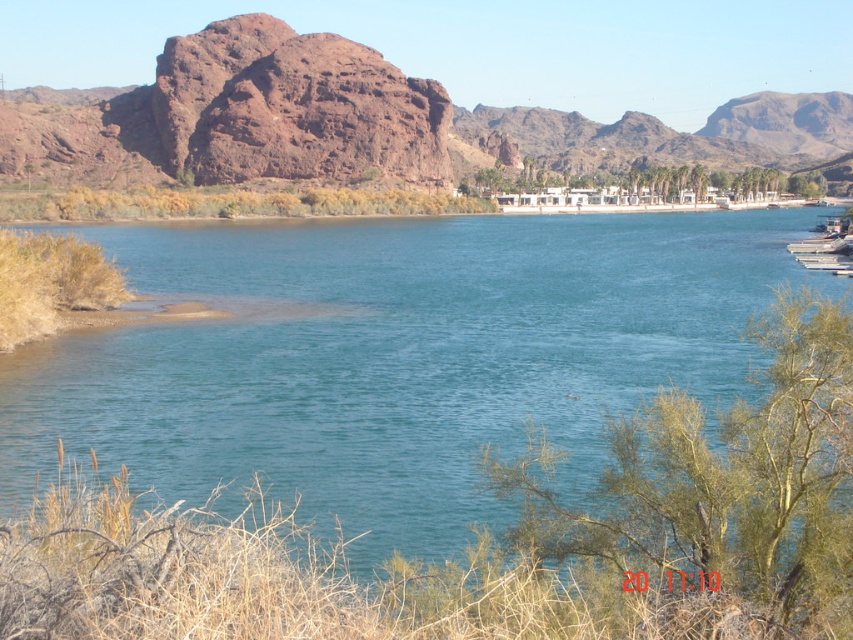
Where is `blue water at center`? This screenshot has width=853, height=640. blue water at center is located at coordinates (399, 358).

From the picture: Between blue water at center and rustic rock formation at upper center, which one appears on the left side from the viewer's perspective?

blue water at center is more to the left.

At what (x,y) coordinates should I click in order to perform the action: click on blue water at center. Please return your answer as a coordinate pair (x, y). The width and height of the screenshot is (853, 640). Looking at the image, I should click on (399, 358).